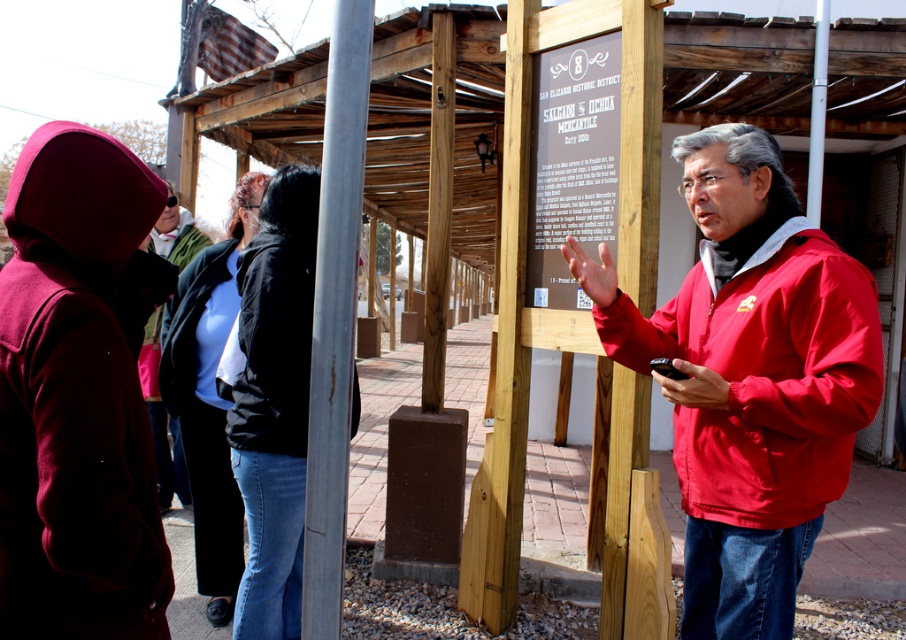
You are a tourist standing under the wooden pergola and see the maroon woolen jacket at left and the dark blue jacket at center. Which jacket is higher up in the image?

The maroon woolen jacket at left is above the dark blue jacket at center, so it is higher up in the image.

Based on the photo, you are a tour guide standing under the wooden pergola. You notice two jackets in the scene. The maroon woolen jacket at left and the matte black jacket at center. Which jacket is positioned lower in the image?

The maroon woolen jacket at left is positioned lower because it is located below the matte black jacket at center.

You are a photographer standing at the base of the pergola, holding a camera. You want to take a photo of the red matte jacket at right without any obstructions. Is the camera close enough to capture the jacket clearly?

The red matte jacket at right and camera are 6.11 feet apart, so the camera is close enough to capture the jacket clearly without needing to move closer.